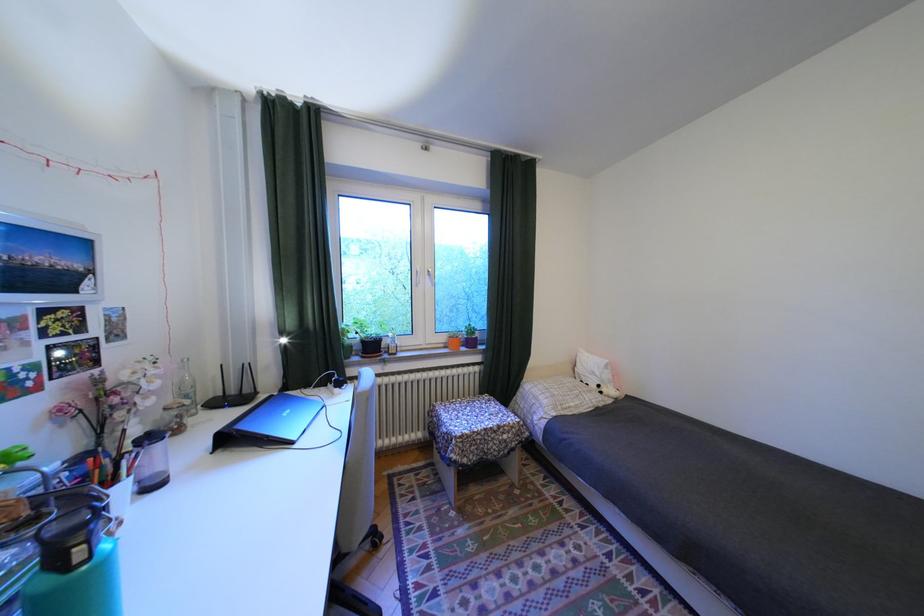
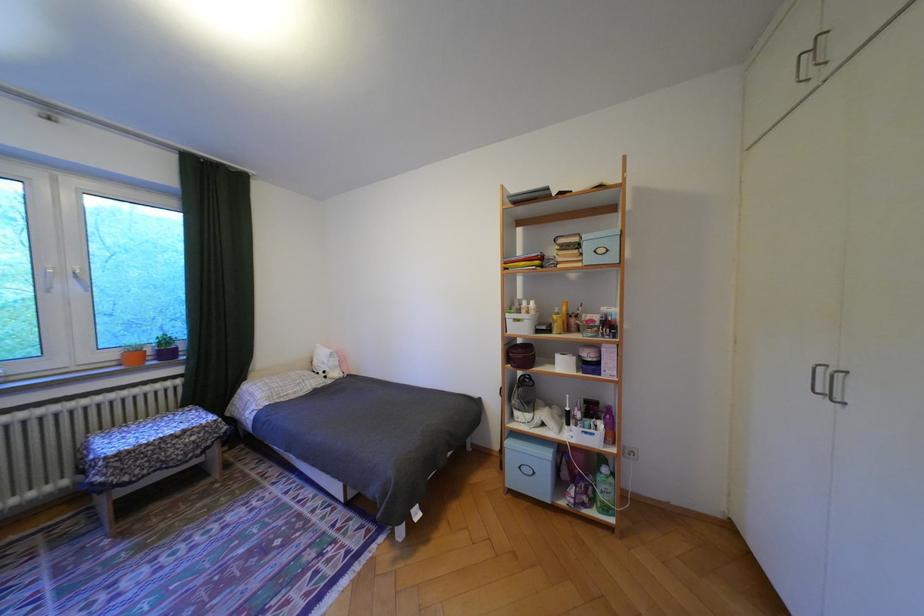
In the second image, find the point that corresponds to (455,339) in the first image.

(124, 355)